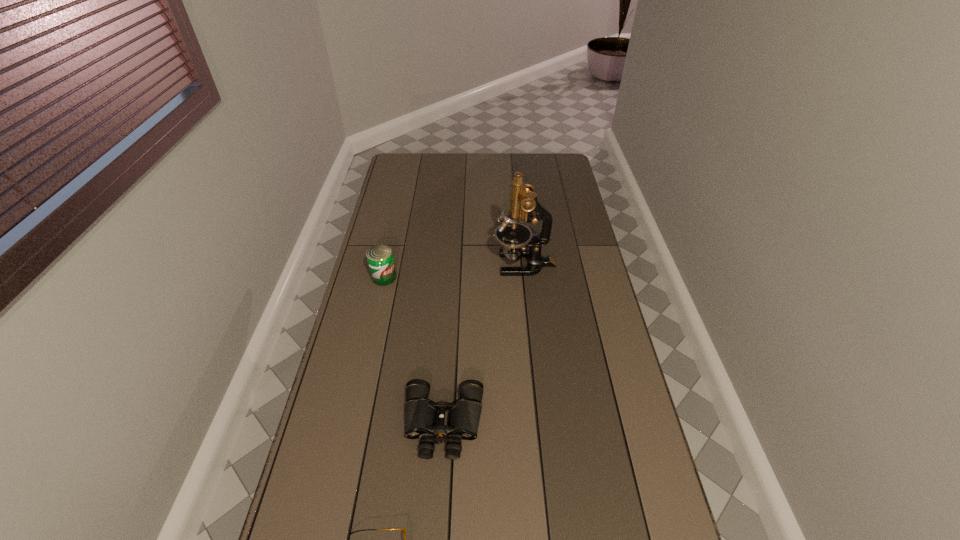
What are the coordinates of `vacant position located through the eyepieces of the binoculars` in the screenshot? It's located at (438, 523).

Identify the location of object that is at the left edge. This screenshot has width=960, height=540. (380, 259).

Find the location of a particular element. The height and width of the screenshot is (540, 960). object that is positioned at the right edge is located at coordinates (515, 237).

Locate an element on the screen. The height and width of the screenshot is (540, 960). free space at the far edge of the desktop is located at coordinates (481, 155).

You are a GUI agent. You are given a task and a screenshot of the screen. Output one action in this format:
    pyautogui.click(x=<x>, y=<y>)
    Task: Click on the free space at the left edge of the desktop
    This screenshot has height=540, width=960.
    Given the screenshot: What is the action you would take?
    pyautogui.click(x=392, y=211)

Locate an element on the screen. vacant space at the right edge of the desktop is located at coordinates (568, 200).

At what (x,y) coordinates should I click in order to perform the action: click on vacant space at the far left corner of the desktop. Please return your answer as a coordinate pair (x, y). This screenshot has height=540, width=960. Looking at the image, I should click on (401, 172).

Identify the location of vacant space at the far right corner of the desktop. The image size is (960, 540). (563, 155).

Image resolution: width=960 pixels, height=540 pixels. Find the location of `empty space between the third shortest object and the second shortest object`. empty space between the third shortest object and the second shortest object is located at coordinates (414, 350).

The image size is (960, 540). What are the coordinates of `unoccupied position between the second nearest object and the microscope` in the screenshot? It's located at (484, 344).